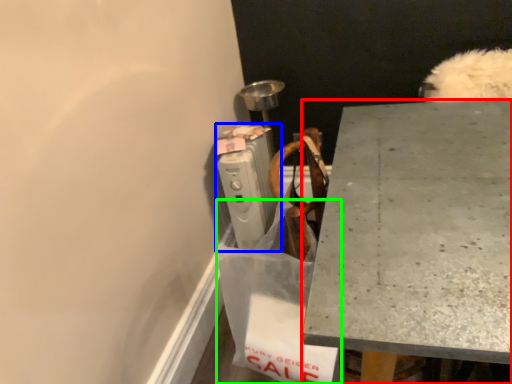
Question: Which is farther away from desk (highlighted by a red box)? radiator (highlighted by a blue box) or shopping bag (highlighted by a green box)?

Choices:
 (A) radiator
 (B) shopping bag

Answer: (A)